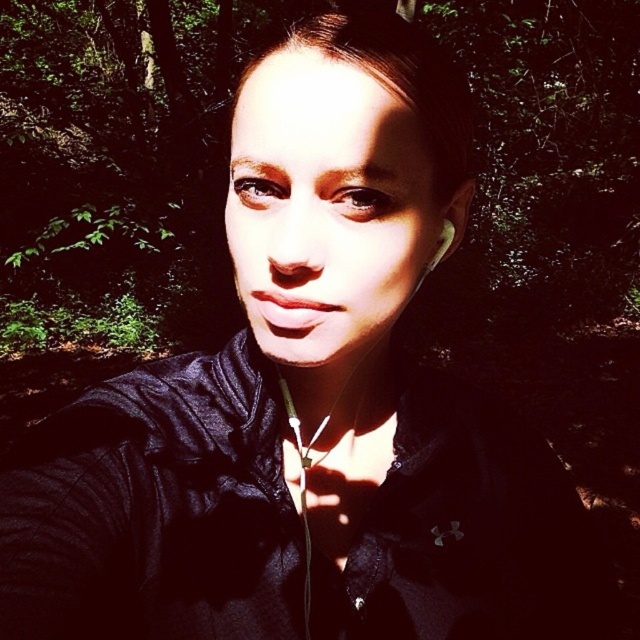
Is point (369, 609) positioned before point (442, 246)?

That is False.

Is black matte jacket at center smaller than silver metallic earring at upper right?

Incorrect, black matte jacket at center is not smaller in size than silver metallic earring at upper right.

Identify the location of black matte jacket at center. (156, 509).

Where is `black matte jacket at center`? black matte jacket at center is located at coordinates (156, 509).